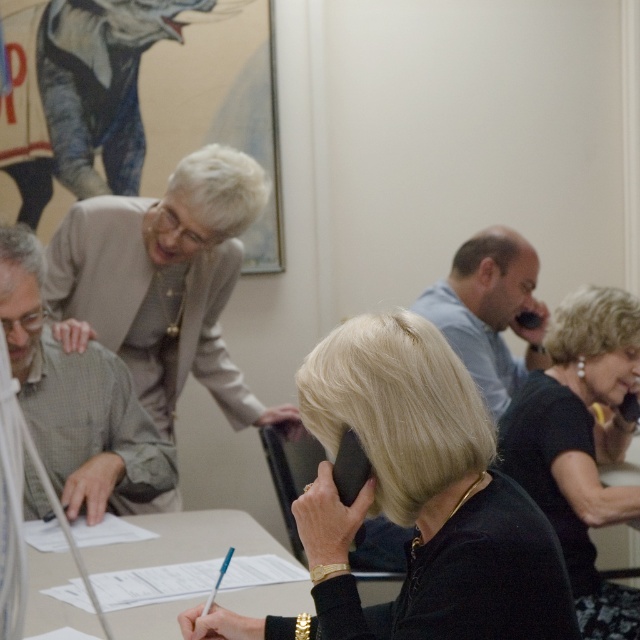
Who is higher up, black matte dress at lower right or green plaid shirt at left?

green plaid shirt at left is above.

Between black matte dress at lower right and green plaid shirt at left, which one has more height?

With more height is black matte dress at lower right.

Between point (577, 305) and point (140, 460), which one is positioned behind?

The point (577, 305) is more distant.

Locate an element on the screen. This screenshot has width=640, height=640. black matte dress at lower right is located at coordinates pos(580,444).

Is black matte phone at center to the right of light blue shirt at center from the viewer's perspective?

No, black matte phone at center is not to the right of light blue shirt at center.

Can you confirm if black matte phone at center is shorter than light blue shirt at center?

Yes, black matte phone at center is shorter than light blue shirt at center.

Is point (385, 390) more distant than point (500, 400)?

That is False.

The width and height of the screenshot is (640, 640). In order to click on black matte phone at center in this screenshot , I will do 422,493.

Between black matte phone at center and white paper at center, which one appears on the right side from the viewer's perspective?

From the viewer's perspective, black matte phone at center appears more on the right side.

Consider the image. Does black matte phone at center have a lesser height compared to white paper at center?

No, black matte phone at center is not shorter than white paper at center.

Measure the distance between point (372, 433) and camera.

The distance of point (372, 433) from camera is 4.02 feet.

Where is `black matte phone at center`? This screenshot has height=640, width=640. black matte phone at center is located at coordinates (422, 493).